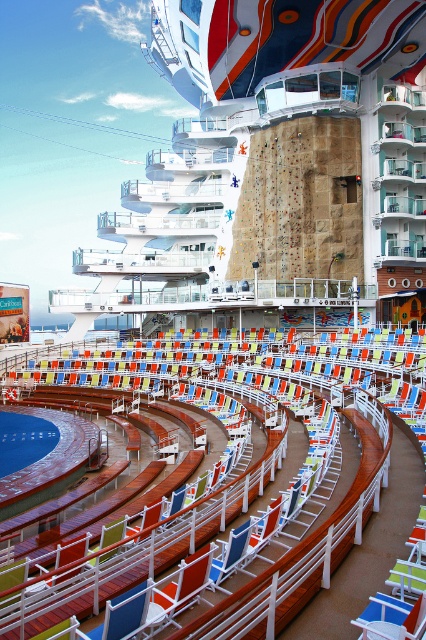
You are standing on the deck of the cruise ship and notice a point marked at coordinates (273,161). What object is located at that specific coordinate?

The white glossy cruise ship at center is located at point (273,161).

You are standing on the deck of the cruise ship and want to move from the blue plastic beach chair at center to the white glossy cruise ship at center. Which direction should you move to reach it?

The white glossy cruise ship at center is located above the blue plastic beach chair at center, so you should move upward to reach it.

You are standing on the cruise ship deck and want to move from the climbing wall to the tiered seating area. You notice two points marked as point [376,92] and point [391,636]. Which point should you move towards to get closer to the tiered seating area?

Point [391,636] is closer to the tiered seating area because point [376,92] is behind it.